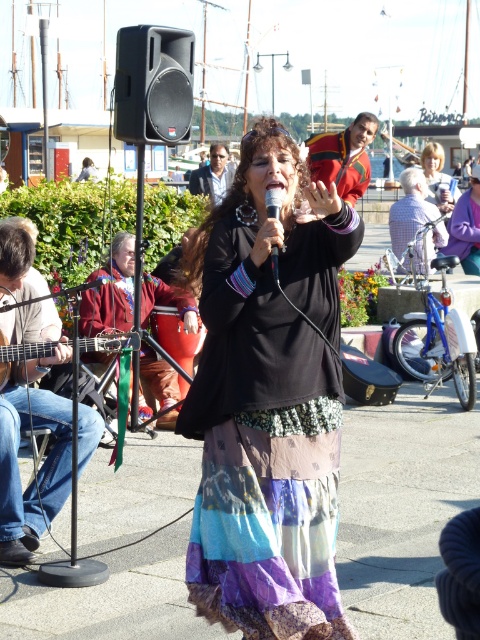
Question: Which of the following is the farthest from the observer?

Choices:
 (A) (160, 310)
 (B) (392, 248)
 (C) (212, 166)

Answer: (C)

Question: Estimate the real-world distances between objects in this image. Which object is farther from the purple fabric at center?

Choices:
 (A) dark blue shirt at center
 (B) wooden acoustic guitar at left
 (C) red leather drum at center

Answer: (B)

Question: Does plaid fabric shirt at center have a lesser width compared to wooden acoustic guitar at left?

Choices:
 (A) yes
 (B) no

Answer: (A)

Question: Does brown leather drum at center lie behind black matte microphone at center?

Choices:
 (A) no
 (B) yes

Answer: (B)

Question: From the image, what is the correct spatial relationship of denim jeans at left in relation to plaid fabric shirt at center?

Choices:
 (A) above
 (B) below

Answer: (B)

Question: Which is nearer to the purple fabric at center?

Choices:
 (A) wooden acoustic guitar at left
 (B) brown leather drum at center

Answer: (B)